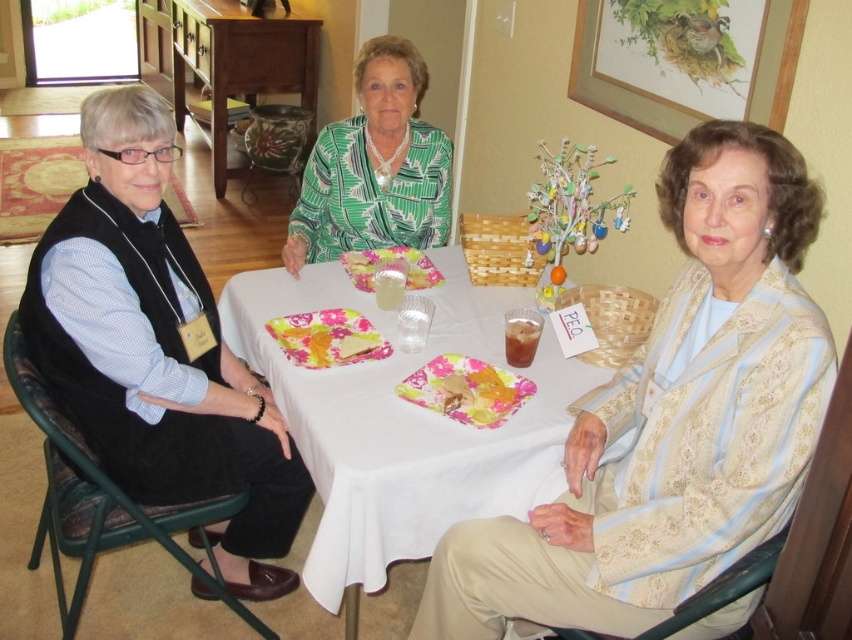
Is wooden picture frame at upper right in front of translucent plastic cup at center?

Yes, it is in front of translucent plastic cup at center.

Which of these two, wooden picture frame at upper right or translucent plastic cup at center, stands taller?

Standing taller between the two is wooden picture frame at upper right.

Which is behind, point (707, 36) or point (340, 260)?

Positioned behind is point (340, 260).

Where is `wooden picture frame at upper right`? The width and height of the screenshot is (852, 640). wooden picture frame at upper right is located at coordinates (737, 51).

Can you confirm if white cloth at center is positioned above translucent plastic cup at center?

No.

Can you confirm if white cloth at center is thinner than translucent plastic cup at center?

In fact, white cloth at center might be wider than translucent plastic cup at center.

Where is `white cloth at center`? Image resolution: width=852 pixels, height=640 pixels. white cloth at center is located at coordinates (403, 420).

Does light beige textured jacket at lower right have a greater width compared to wooden picture frame at upper right?

Yes.

Find the location of a particular element. light beige textured jacket at lower right is located at coordinates (671, 419).